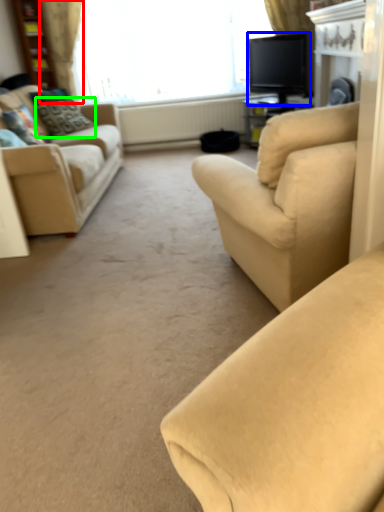
Question: Considering the real-world distances, which object is closest to curtain (highlighted by a red box)? television (highlighted by a blue box) or pillow (highlighted by a green box).

Choices:
 (A) television
 (B) pillow

Answer: (B)